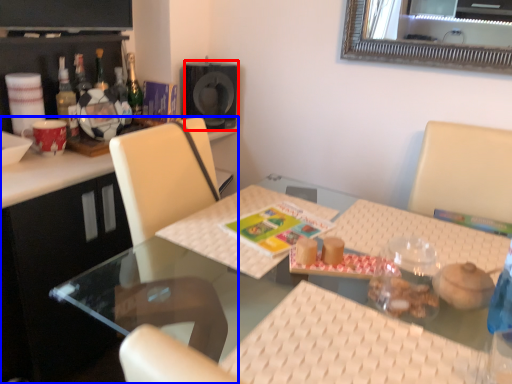
Question: Which object is further to the camera taking this photo, speaker (highlighted by a red box) or desk (highlighted by a blue box)?

Choices:
 (A) speaker
 (B) desk

Answer: (A)